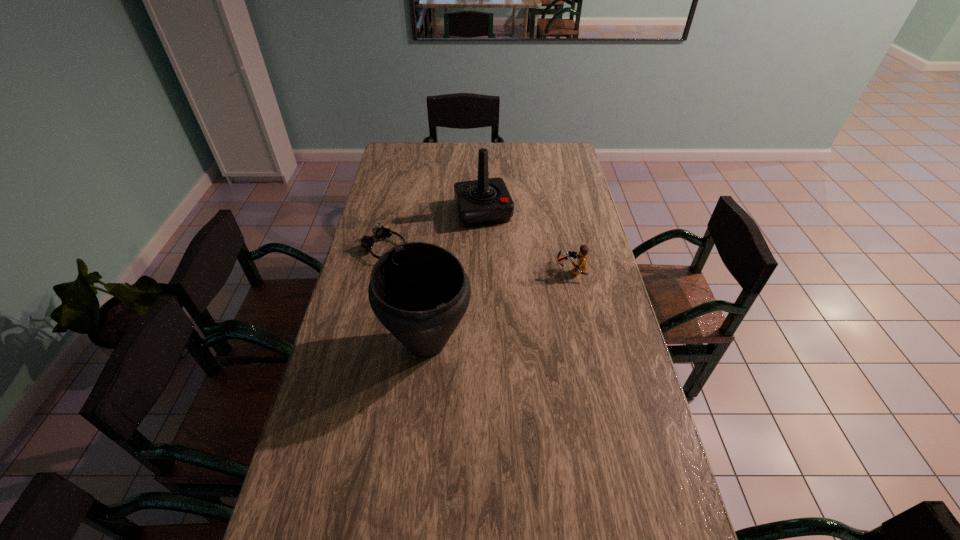
In order to click on vacant region located 0.400m on the front-facing side of the farthest object in this screenshot , I will do `click(517, 305)`.

The height and width of the screenshot is (540, 960). In order to click on vacant area located on the front-facing side of the farthest object in this screenshot , I will do `click(495, 245)`.

I want to click on vacant region located 0.380m through the lenses of the goggles, so click(488, 301).

I want to click on vacant space positioned 0.290m through the lenses of the goggles, so click(x=466, y=290).

Find the location of `vacant space located through the lenses of the goggles`. vacant space located through the lenses of the goggles is located at coordinates (412, 262).

This screenshot has height=540, width=960. What are the coordinates of `urn situated at the left edge` in the screenshot? It's located at (419, 291).

You are a GUI agent. You are given a task and a screenshot of the screen. Output one action in this format:
    pyautogui.click(x=<x>, y=<y>)
    Task: Click on the goggles located at the left edge
    The width and height of the screenshot is (960, 540).
    Given the screenshot: What is the action you would take?
    pyautogui.click(x=379, y=232)

Locate an element on the screen. This screenshot has width=960, height=540. object located at the right edge is located at coordinates (581, 257).

I want to click on vacant space at the far edge, so [x=430, y=162].

Identify the location of free location at the near edge of the desktop. The height and width of the screenshot is (540, 960). 608,535.